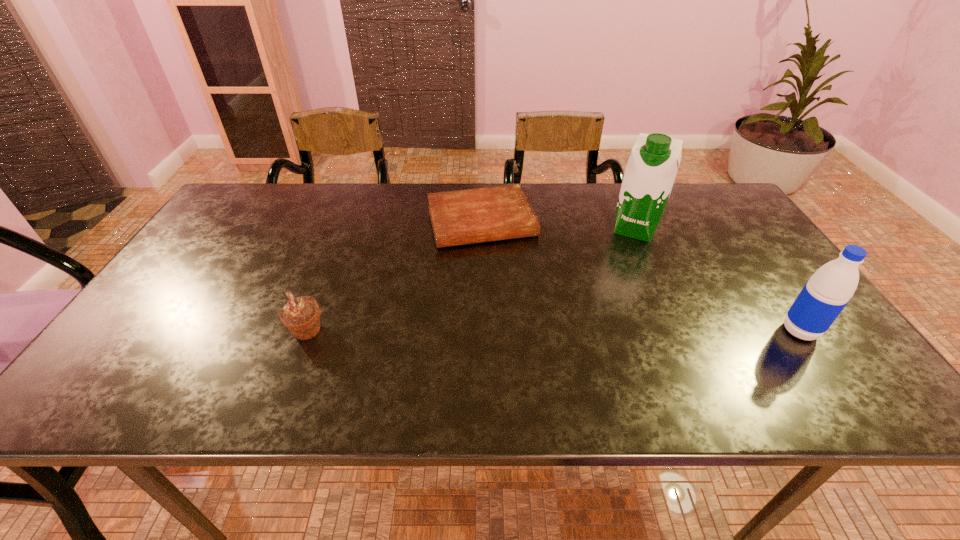
I want to click on free spot between the muffin and the rightmost object, so click(553, 331).

At what (x,y) coordinates should I click in order to perform the action: click on vacant area that lies between the muffin and the shortest object. Please return your answer as a coordinate pair (x, y). This screenshot has height=540, width=960. Looking at the image, I should click on (394, 276).

Where is `free space between the third tallest object and the rightmost object`? The height and width of the screenshot is (540, 960). free space between the third tallest object and the rightmost object is located at coordinates (553, 331).

Identify the location of free spot between the Bible and the tallest object. (558, 225).

Identify the location of vacant area that lies between the third object from right to left and the second object from right to left. 558,225.

You are a GUI agent. You are given a task and a screenshot of the screen. Output one action in this format:
    pyautogui.click(x=<x>, y=<y>)
    Task: Click on the free space that is in between the leftmost object and the third object from left to right
    
    Given the screenshot: What is the action you would take?
    pyautogui.click(x=470, y=280)

Where is `vacant space in between the rightmost object and the leftmost object`? The width and height of the screenshot is (960, 540). vacant space in between the rightmost object and the leftmost object is located at coordinates (553, 331).

I want to click on free space between the soya milk and the water bottle, so click(717, 280).

This screenshot has height=540, width=960. In order to click on free space between the leftmost object and the second object from left to right in this screenshot , I will do coord(394,276).

Identify which object is the closest to the third object from left to right. Please provide its 2D coordinates. Your answer should be formatted as a tuple, i.e. [(x, y)], where the tuple contains the x and y coordinates of a point satisfying the conditions above.

[(460, 217)]